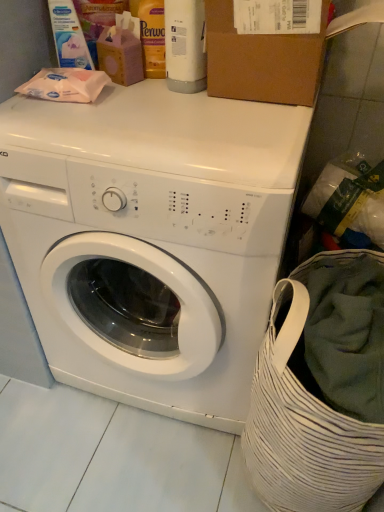
Question: Considering the positions of white glossy bottle at upper center, acting as the 1th cleaning product starting from the right, and matte white wipes at upper left, which is counted as the second cleaning product, starting from the right, in the image, is white glossy bottle at upper center, acting as the 1th cleaning product starting from the right, wider or thinner than matte white wipes at upper left, which is counted as the second cleaning product, starting from the right,?

Choices:
 (A) thin
 (B) wide

Answer: (B)

Question: Looking at the image, does white glossy bottle at upper center, acting as the 1th cleaning product starting from the right, seem bigger or smaller compared to matte white wipes at upper left, the first cleaning product viewed from the left?

Choices:
 (A) big
 (B) small

Answer: (A)

Question: Which object is the farthest from the white glossy bottle at upper center, acting as the second cleaning product starting from the left?

Choices:
 (A) brown cardboard box at upper center
 (B) matte white wipes at upper left, the first cleaning product viewed from the left
 (C) white matte washing machine at center
 (D) white striped fabric laundry basket at lower right

Answer: (D)

Question: Estimate the real-world distances between objects in this image. Which object is farther from the matte white wipes at upper left, the first cleaning product viewed from the left?

Choices:
 (A) white glossy bottle at upper center, acting as the 1th cleaning product starting from the right
 (B) white matte washing machine at center
 (C) brown cardboard box at upper center
 (D) white striped fabric laundry basket at lower right

Answer: (D)